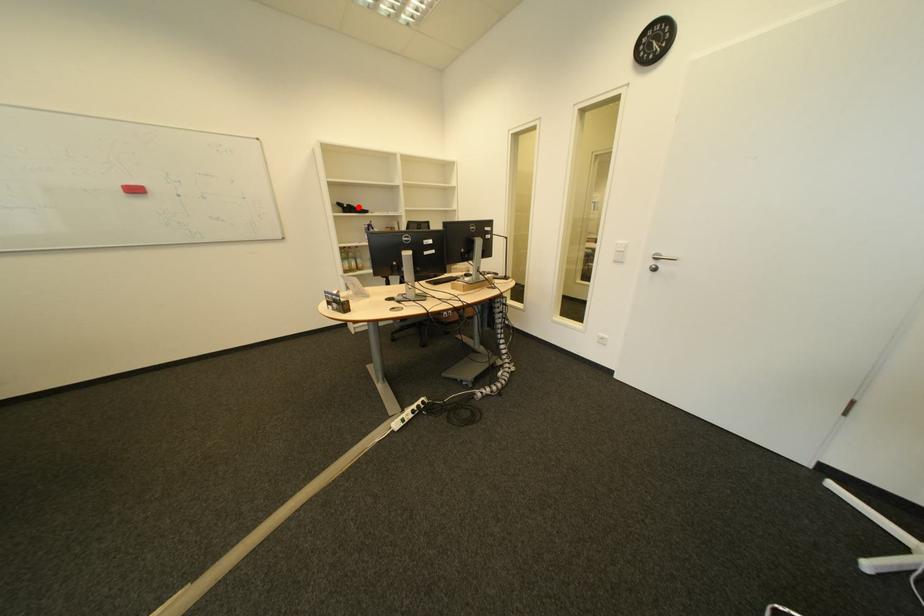
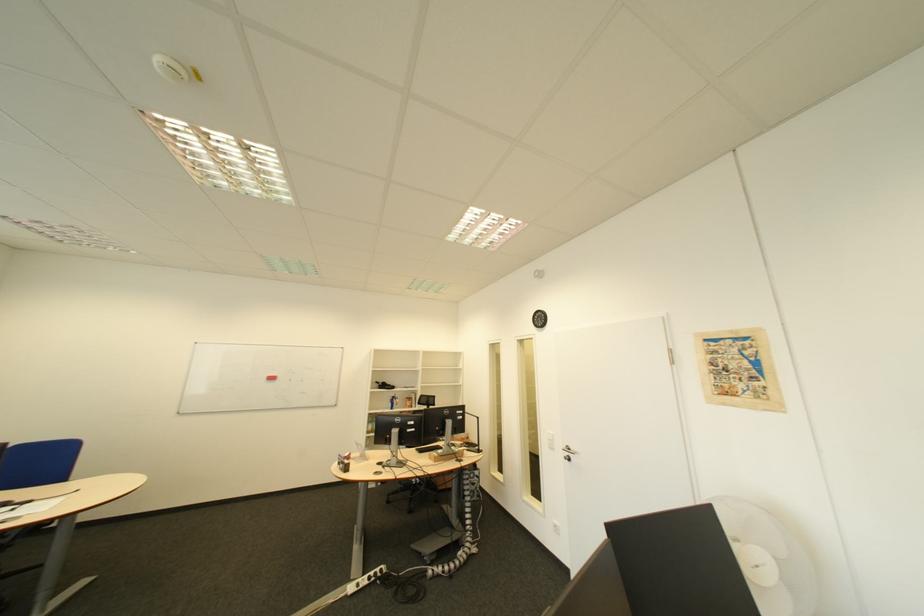
Question: I am providing you with two images of the same scene from different viewpoints. A red point is shown in image1. For the corresponding object point in image2, is it positioned nearer or farther from the camera?

Choices:
 (A) Nearer
 (B) Farther

Answer: (B)